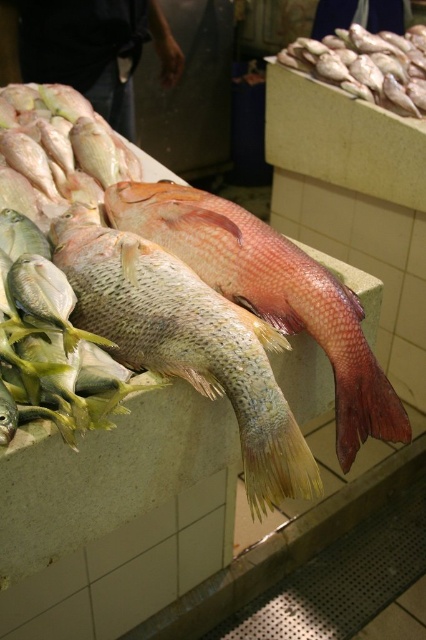
Question: Does shiny pinkish-red fish at center appear under shiny silver fish at upper right?

Choices:
 (A) no
 (B) yes

Answer: (B)

Question: Is shiny pinkish-red fish at center bigger than shiny silver fish at upper right?

Choices:
 (A) no
 (B) yes

Answer: (A)

Question: Among these objects, which one is farthest from the camera?

Choices:
 (A) shiny silver fish at upper right
 (B) shiny pinkish-red fish at center

Answer: (A)

Question: Which point is closer to the camera taking this photo?

Choices:
 (A) (308, 314)
 (B) (337, 67)

Answer: (A)

Question: Can you confirm if shiny pinkish-red fish at center is positioned to the right of shiny silver fish at upper right?

Choices:
 (A) yes
 (B) no

Answer: (B)

Question: Which point appears farthest from the camera in this image?

Choices:
 (A) (345, 406)
 (B) (324, 60)

Answer: (B)